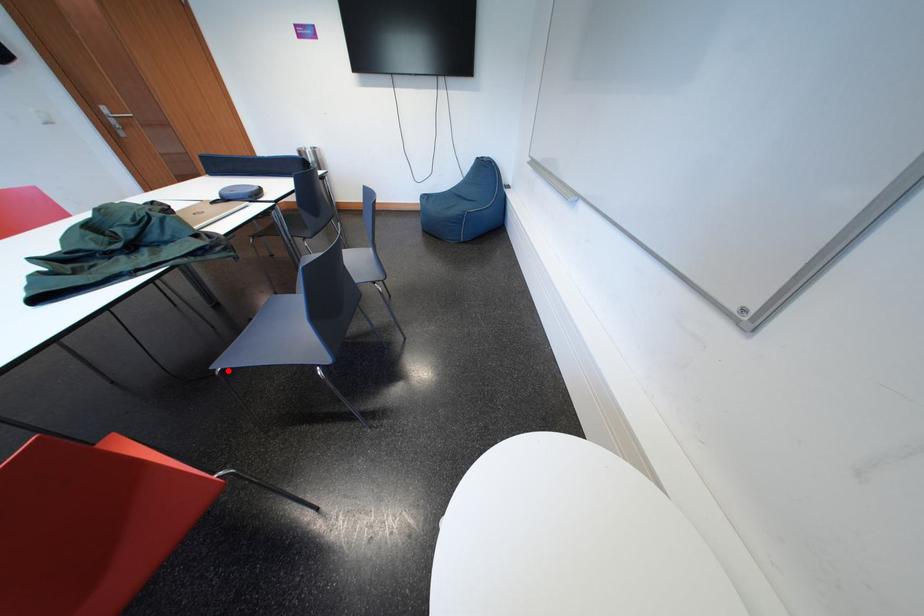
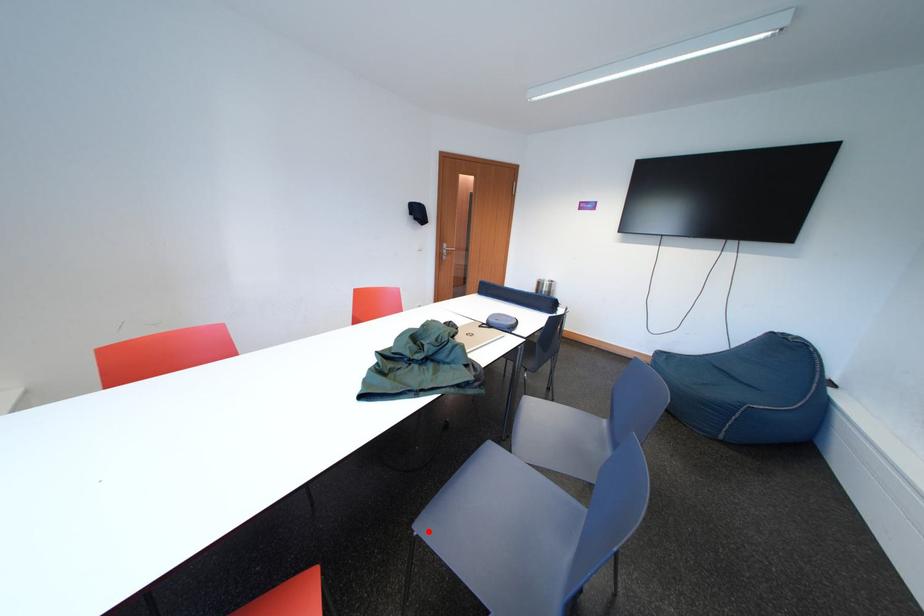
I am providing you with two images of the same scene from different viewpoints. A red point is marked on the first image and another point is marked on the second image. Are the points marked in image1 and image2 representing the same 3D position?

Yes